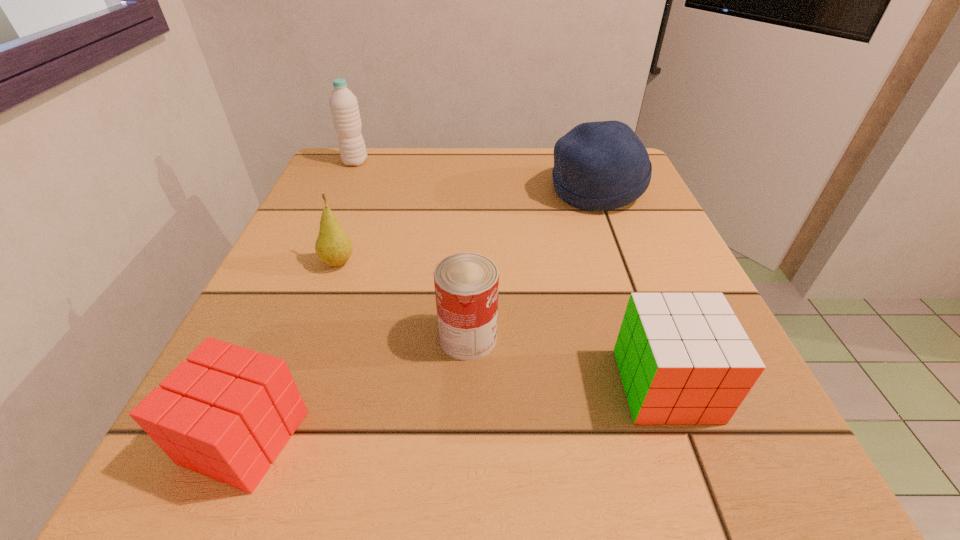
What are the coordinates of `the tallest object` in the screenshot? It's located at (344, 107).

What are the coordinates of `water bottle` in the screenshot? It's located at [344, 107].

Locate an element on the screen. The height and width of the screenshot is (540, 960). the fifth shortest object is located at coordinates (598, 166).

Find the location of a particular element. This screenshot has height=540, width=960. skullcap is located at coordinates (598, 166).

I want to click on the third farthest object, so click(333, 246).

This screenshot has height=540, width=960. In order to click on can in this screenshot , I will do `click(466, 284)`.

Locate an element on the screen. The image size is (960, 540). the right cube is located at coordinates [684, 358].

Locate an element on the screen. The height and width of the screenshot is (540, 960). the left cube is located at coordinates (226, 413).

Find the location of `vacant region located on the right of the tallest object`. vacant region located on the right of the tallest object is located at coordinates (431, 162).

Locate an element on the screen. The image size is (960, 540). vacant space positioned on the front of the skullcap is located at coordinates (613, 238).